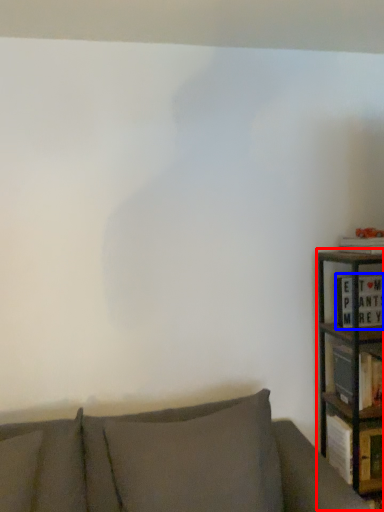
Question: Which point is further to the camera, bookcase (highlighted by a red box) or book (highlighted by a blue box)?

Choices:
 (A) bookcase
 (B) book

Answer: (B)